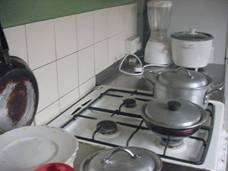
Find the location of a particular element. This screenshot has height=171, width=228. tile is located at coordinates (73, 48).